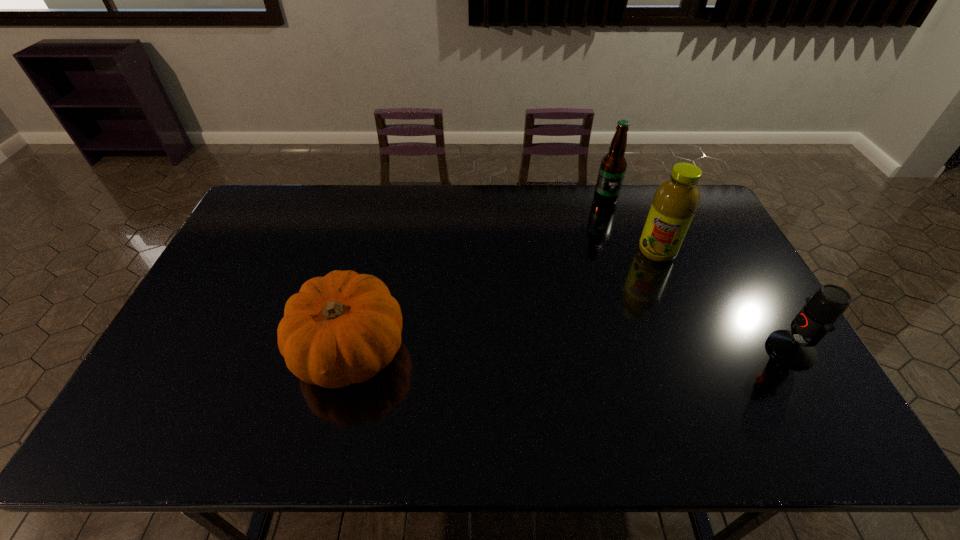
Identify the location of free space at the near edge of the desktop. (663, 391).

Where is `vacant region at the left edge of the desktop`? vacant region at the left edge of the desktop is located at coordinates (x=220, y=296).

Image resolution: width=960 pixels, height=540 pixels. In the image, there is a desktop. Identify the location of vacant space at the right edge. (712, 234).

Locate an element on the screen. vacant space at the near right corner is located at coordinates (745, 383).

Where is `free space between the microphone and the fruit juice`? free space between the microphone and the fruit juice is located at coordinates (724, 301).

You are a GUI agent. You are given a task and a screenshot of the screen. Output one action in this format:
    pyautogui.click(x=<x>, y=<y>)
    Task: Click on the empty space between the pumpkin and the rightmost object
    
    Given the screenshot: What is the action you would take?
    pyautogui.click(x=570, y=350)

You are a GUI agent. You are given a task and a screenshot of the screen. Output one action in this format:
    pyautogui.click(x=<x>, y=<y>)
    Task: Click on the vacant area between the leftmost object and the third object from left to right
    This screenshot has height=540, width=960.
    Given the screenshot: What is the action you would take?
    (x=504, y=300)

Where is `vacant area that lies between the third nearest object and the microphone`? The width and height of the screenshot is (960, 540). vacant area that lies between the third nearest object and the microphone is located at coordinates (724, 301).

You are a GUI agent. You are given a task and a screenshot of the screen. Output one action in this format:
    pyautogui.click(x=<x>, y=<y>)
    Task: Click on the free space between the third object from right to left and the leftmost object
    The height and width of the screenshot is (540, 960).
    Given the screenshot: What is the action you would take?
    pyautogui.click(x=478, y=275)

At what (x,y) coordinates should I click in order to perform the action: click on vacant space in between the pumpkin and the second object from right to left. Please return your answer as a coordinate pair (x, y). Looking at the image, I should click on (504, 300).